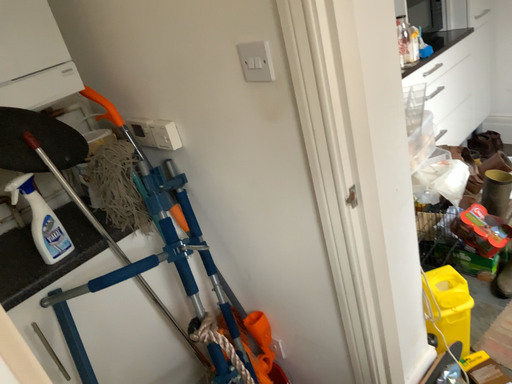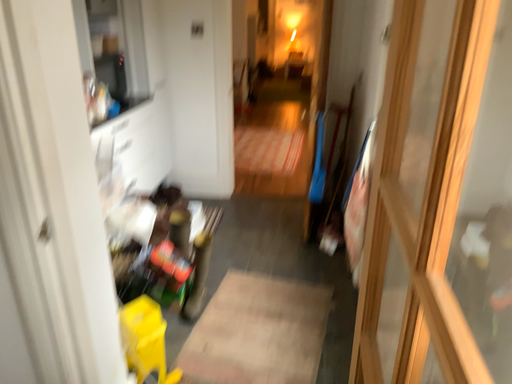
Question: How did the camera likely rotate when shooting the video?

Choices:
 (A) rotated upward
 (B) rotated downward

Answer: (A)